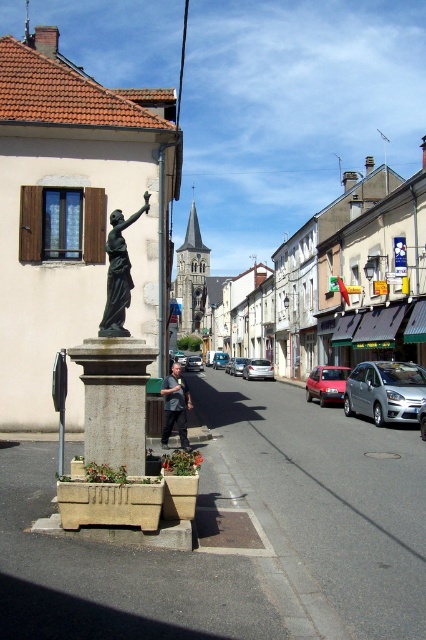
Between dark gray shirt at center and matte red car at center, which one has less height?

With less height is dark gray shirt at center.

Is dark gray shirt at center behind matte red car at center?

No, it is not.

Find the location of a particular element. This screenshot has height=640, width=426. dark gray shirt at center is located at coordinates pos(175,404).

Based on the photo, does silver metallic hatchback at center-right lie in front of matte red car at center?

Yes, silver metallic hatchback at center-right is closer to the viewer.

At what (x,y) coordinates should I click in order to perform the action: click on silver metallic hatchback at center-right. Please return your answer as a coordinate pair (x, y). The width and height of the screenshot is (426, 640). Looking at the image, I should click on (385, 392).

This screenshot has height=640, width=426. Identify the location of silver metallic hatchback at center-right. (385, 392).

Is dark gray shirt at center taller than silver metallic car at center?

Incorrect, dark gray shirt at center's height is not larger of silver metallic car at center's.

Does dark gray shirt at center appear on the left side of silver metallic car at center?

Incorrect, dark gray shirt at center is not on the left side of silver metallic car at center.

This screenshot has width=426, height=640. Describe the element at coordinates (175, 404) in the screenshot. I see `dark gray shirt at center` at that location.

You are a GUI agent. You are given a task and a screenshot of the screen. Output one action in this format:
    pyautogui.click(x=<x>, y=<y>)
    Task: Click on the dark gray shirt at center
    
    Given the screenshot: What is the action you would take?
    [175, 404]